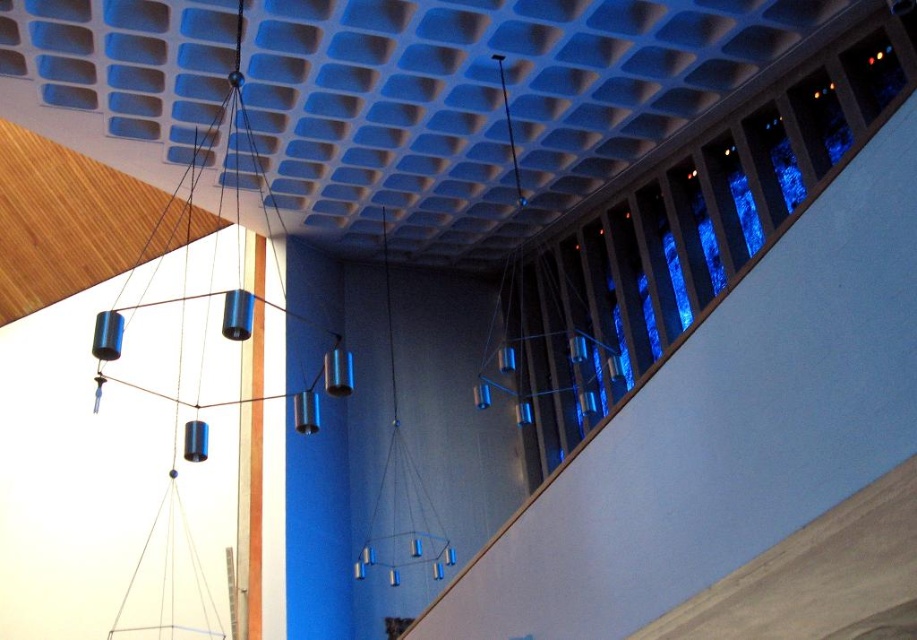
Question: From the image, what is the correct spatial relationship of metallic blue hanging light at center in relation to metallic cylinders at upper right?

Choices:
 (A) below
 (B) above

Answer: (A)

Question: In this image, where is metallic blue hanging light at center located relative to metallic cylinders at upper right?

Choices:
 (A) below
 (B) above

Answer: (A)

Question: Can you confirm if metallic blue hanging light at center is smaller than metallic cylinders at upper right?

Choices:
 (A) no
 (B) yes

Answer: (A)

Question: Which point is farther to the camera?

Choices:
 (A) metallic blue hanging light at center
 (B) metallic cylinders at upper right

Answer: (A)

Question: Which point is closer to the camera taking this photo?

Choices:
 (A) (389, 440)
 (B) (514, 150)

Answer: (B)